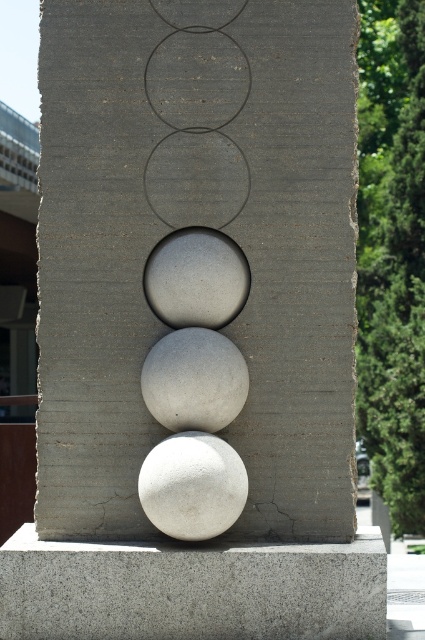
You are an architect analyzing the sculpture. You need to determine the relative positions of the gray rough sphere at center and the smooth concrete circle at upper center. Which object is positioned to the left of the other?

The gray rough sphere at center is positioned to the left of the smooth concrete circle at upper center.